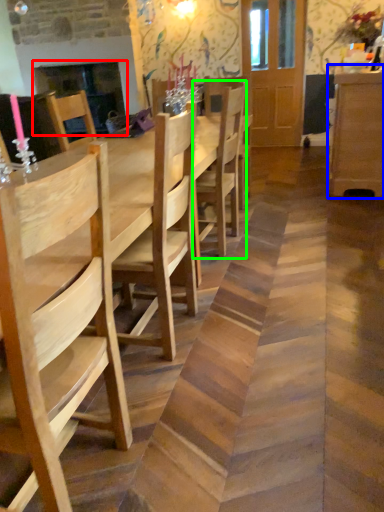
Question: Which is farther away from fireplace (highlighted by a red box)? dresser (highlighted by a blue box) or chair (highlighted by a green box)?

Choices:
 (A) dresser
 (B) chair

Answer: (A)